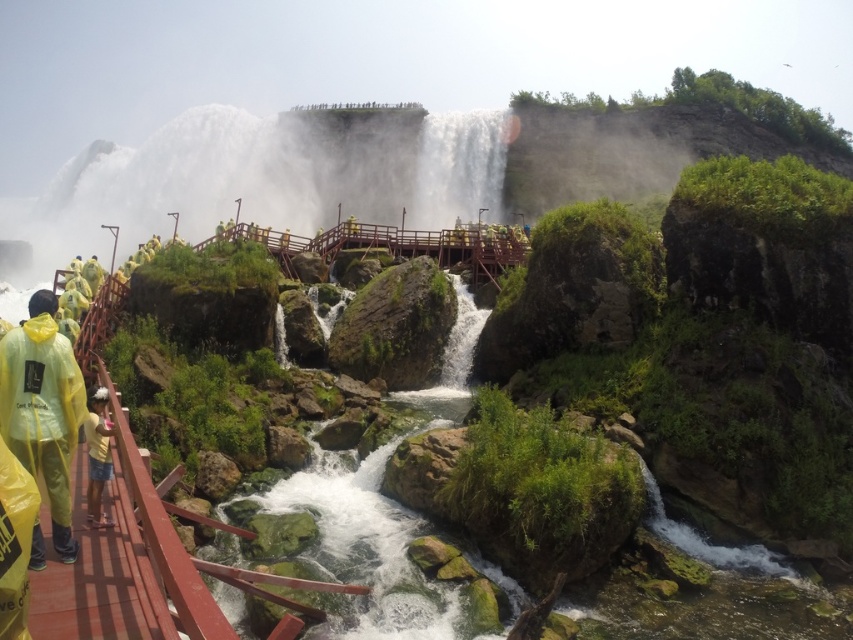
Question: Is yellow translucent raincoat at lower left bigger than yellow matte shorts at lower left?

Choices:
 (A) yes
 (B) no

Answer: (A)

Question: Is yellow translucent raincoat at lower left below yellow matte shorts at lower left?

Choices:
 (A) yes
 (B) no

Answer: (B)

Question: Does yellow translucent raincoat at lower left have a larger size compared to yellow matte shorts at lower left?

Choices:
 (A) no
 (B) yes

Answer: (B)